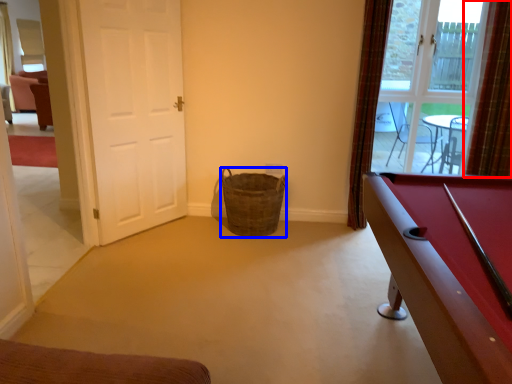
Question: Which object appears closest to the camera in this image, curtain (highlighted by a red box) or basket (highlighted by a blue box)?

Choices:
 (A) curtain
 (B) basket

Answer: (A)